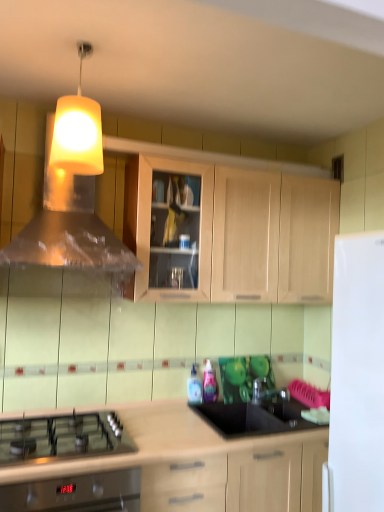
Question: Is the position of transparent glass tap at center less distant than that of light wood cabinet at lower center, the 2th cabinetry when ordered from top to bottom?

Choices:
 (A) yes
 (B) no

Answer: (B)

Question: Is transparent glass tap at center located outside light wood cabinet at lower center, the first cabinetry from the bottom?

Choices:
 (A) yes
 (B) no

Answer: (A)

Question: Considering the relative sizes of transparent glass tap at center and light wood cabinet at lower center, the first cabinetry from the bottom, in the image provided, is transparent glass tap at center shorter than light wood cabinet at lower center, the first cabinetry from the bottom,?

Choices:
 (A) no
 (B) yes

Answer: (B)

Question: From a real-world perspective, is transparent glass tap at center physically below light wood cabinet at lower center, the 2th cabinetry when ordered from top to bottom?

Choices:
 (A) yes
 (B) no

Answer: (B)

Question: Can you confirm if transparent glass tap at center is smaller than light wood cabinet at lower center, the 2th cabinetry when ordered from top to bottom?

Choices:
 (A) no
 (B) yes

Answer: (B)

Question: Can you confirm if transparent glass tap at center is bigger than light wood cabinet at lower center, the 2th cabinetry when ordered from top to bottom?

Choices:
 (A) yes
 (B) no

Answer: (B)

Question: Is light wood cabinet at upper center, which appears as the 1th cabinetry when viewed from the top, oriented towards translucent plastic bottle at center, the second bottle when ordered from left to right?

Choices:
 (A) yes
 (B) no

Answer: (B)

Question: Does light wood cabinet at upper center, which appears as the 1th cabinetry when viewed from the top, have a lesser height compared to translucent plastic bottle at center, the second bottle when ordered from left to right?

Choices:
 (A) no
 (B) yes

Answer: (A)

Question: Is light wood cabinet at upper center, which appears as the 1th cabinetry when viewed from the top, taller than translucent plastic bottle at center, the second bottle when ordered from left to right?

Choices:
 (A) yes
 (B) no

Answer: (A)

Question: Is there a large distance between light wood cabinet at upper center, which appears as the 1th cabinetry when viewed from the top, and translucent plastic bottle at center, the second bottle when ordered from left to right?

Choices:
 (A) yes
 (B) no

Answer: (B)

Question: Does light wood cabinet at upper center, which appears as the 1th cabinetry when viewed from the top, have a smaller size compared to translucent plastic bottle at center, the second bottle when ordered from left to right?

Choices:
 (A) yes
 (B) no

Answer: (B)

Question: Would you say light wood cabinet at upper center, which ranks as the 2th cabinetry in bottom-to-top order, is outside translucent plastic bottle at center, the second bottle when ordered from left to right?

Choices:
 (A) no
 (B) yes

Answer: (B)

Question: Is yellow matte lampshade at upper center shorter than light wood cabinet at lower center, the 2th cabinetry when ordered from top to bottom?

Choices:
 (A) yes
 (B) no

Answer: (A)